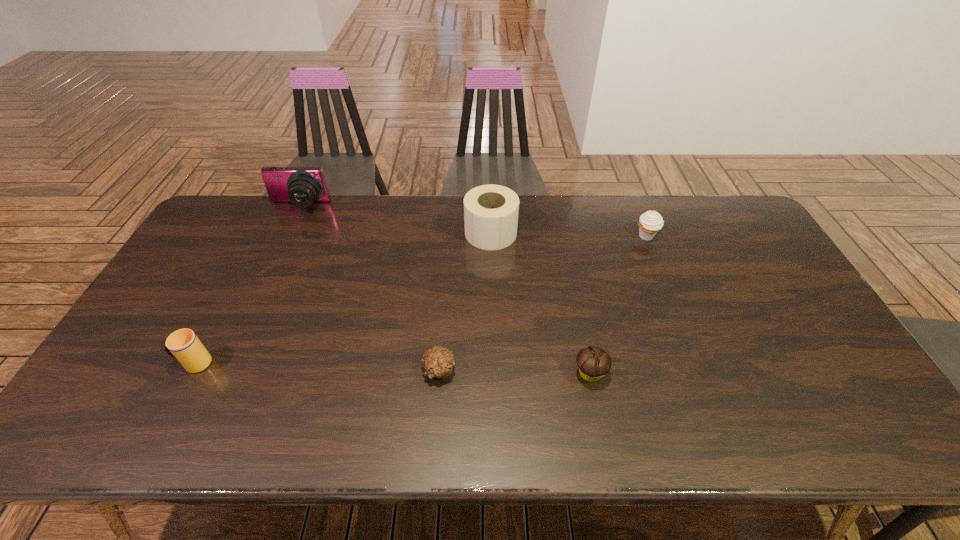
The width and height of the screenshot is (960, 540). I want to click on vacant space situated on the front of the toilet tissue, so click(493, 330).

Where is `free spot located 0.120m on the right of the rightmost object`? This screenshot has height=540, width=960. free spot located 0.120m on the right of the rightmost object is located at coordinates (694, 236).

The height and width of the screenshot is (540, 960). What are the coordinates of `free location located 0.160m on the side of the cup with the handle` in the screenshot? It's located at (113, 363).

Locate an element on the screen. The image size is (960, 540). free space located 0.100m on the front of the second shortest muffin is located at coordinates (601, 428).

Identify the location of vacant area situated 0.180m on the left of the fourth object from right to left. (350, 370).

You are a GUI agent. You are given a task and a screenshot of the screen. Output one action in this format:
    pyautogui.click(x=<x>, y=<y>)
    Task: Click on the camera that is at the far edge
    
    Given the screenshot: What is the action you would take?
    pyautogui.click(x=302, y=186)

You are a GUI agent. You are given a task and a screenshot of the screen. Output one action in this format:
    pyautogui.click(x=<x>, y=<y>)
    Task: Click on the toilet tissue positioned at the far edge
    The image size is (960, 540).
    Given the screenshot: What is the action you would take?
    tap(491, 211)

Locate an element on the screen. muffin located at the far edge is located at coordinates (651, 222).

This screenshot has height=540, width=960. In order to click on object that is at the left edge in this screenshot , I will do `click(183, 345)`.

The width and height of the screenshot is (960, 540). Identify the location of free space at the far edge of the desktop. (329, 209).